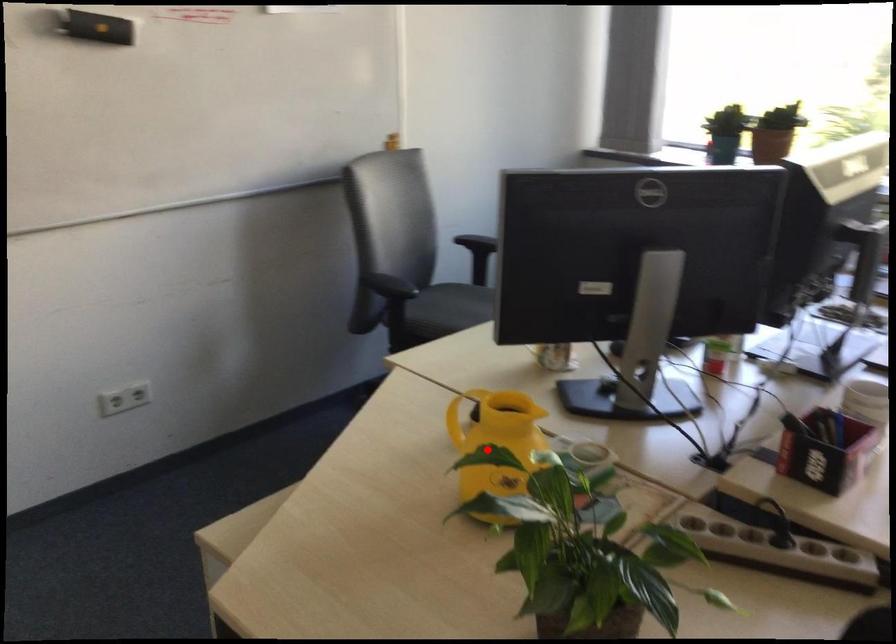
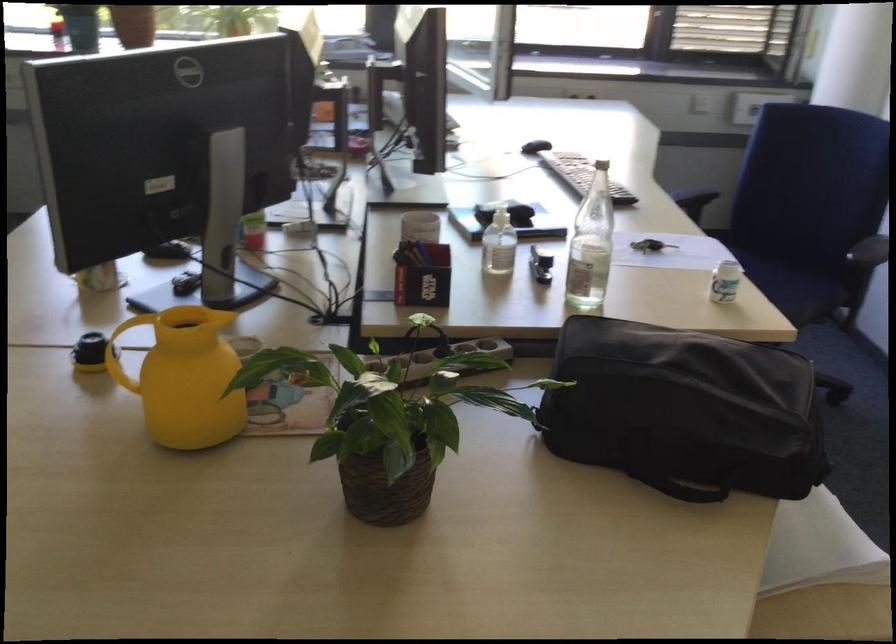
Question: I am providing you with two images of the same scene from different viewpoints. Image1 has a red point marked. In image2, the corresponding 3D location appears at what relative position? Reply with the corresponding letter.

Choices:
 (A) Closer
 (B) Farther

Answer: (B)